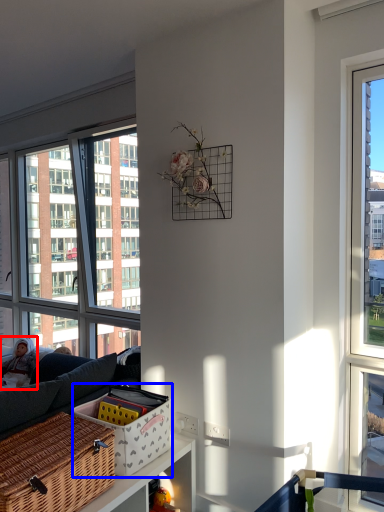
Question: Among these objects, which one is nearest to the camera, couple (highlighted by a red box) or basket (highlighted by a blue box)?

Choices:
 (A) couple
 (B) basket

Answer: (B)